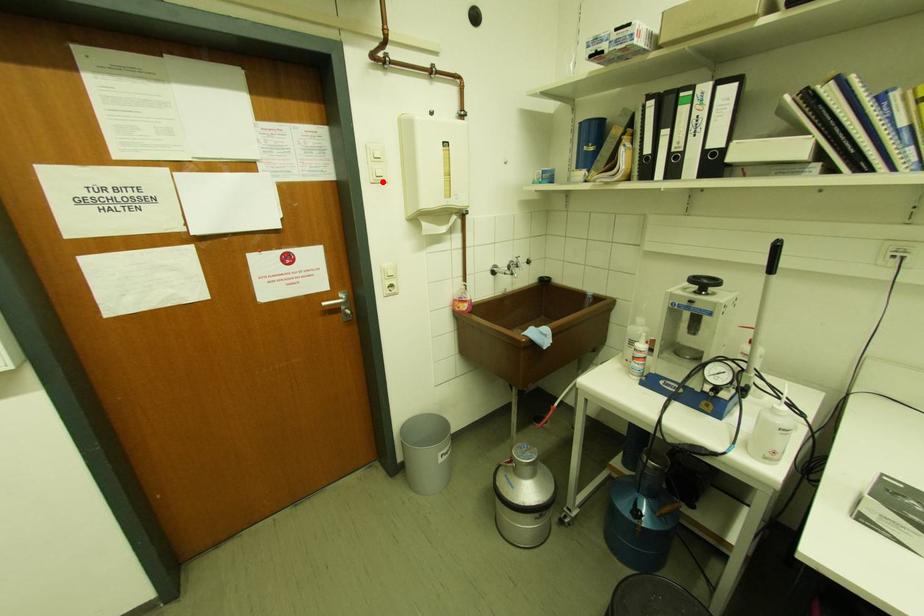
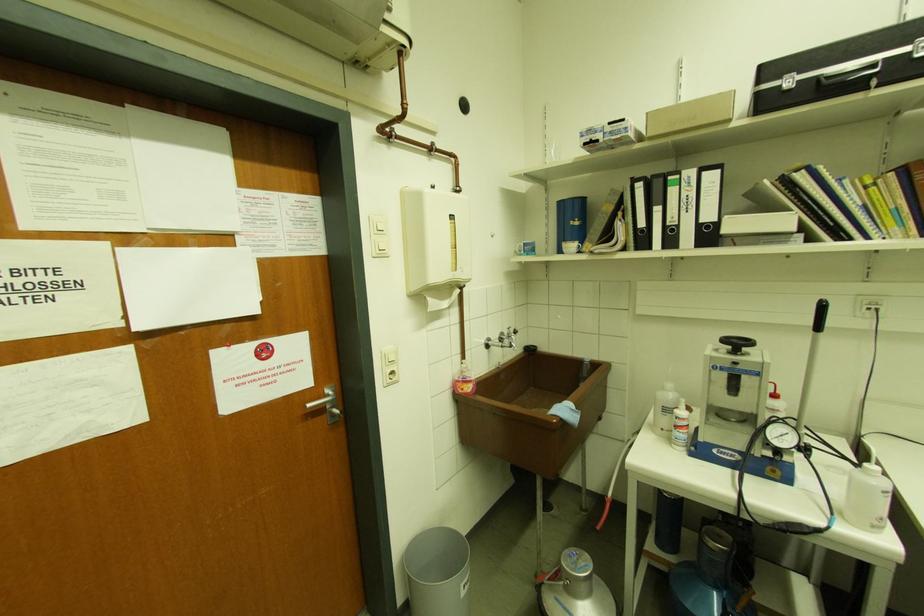
Find the pixel in the second image that matches the highlighted location in the first image.

(385, 256)